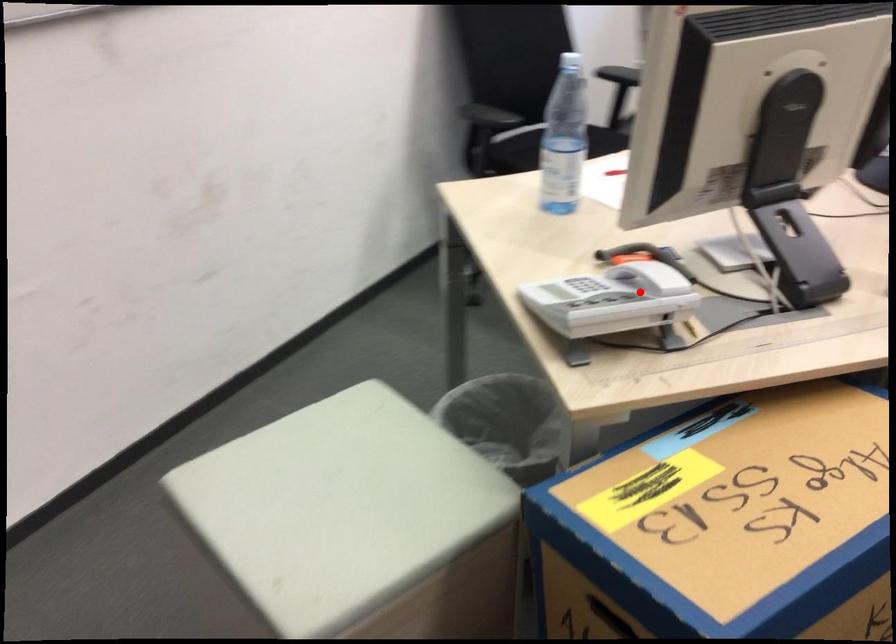
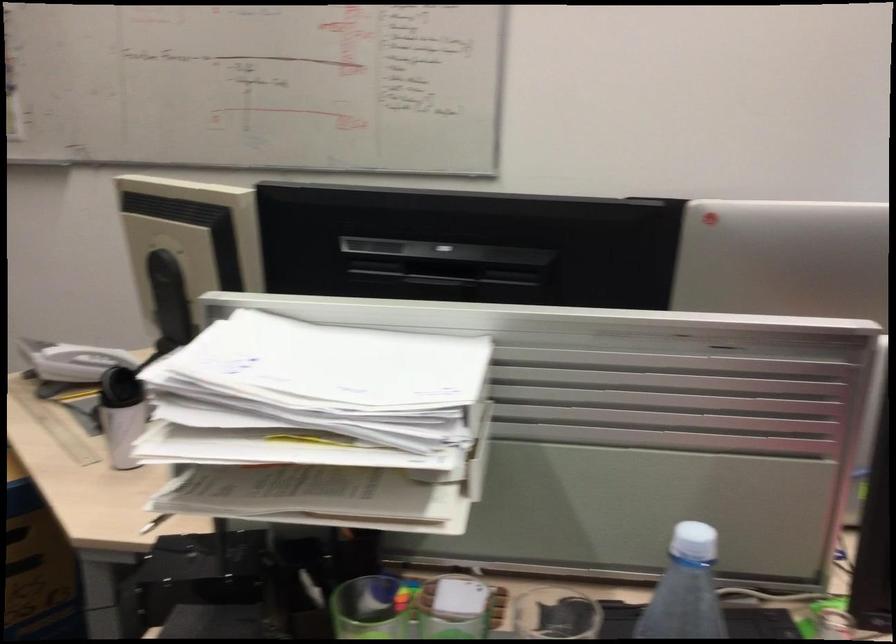
Question: I am providing you with two images of the same scene from different viewpoints. Given a red point in image1, look at the same physical point in image2. Is it:

Choices:
 (A) Closer to the viewpoint
 (B) Farther from the viewpoint

Answer: (B)